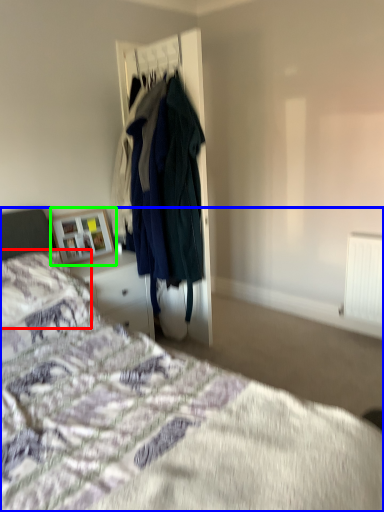
Question: Which object is positioned farthest from pillow (highlighted by a red box)? Select from bed (highlighted by a blue box) and picture frame (highlighted by a green box).

Choices:
 (A) bed
 (B) picture frame

Answer: (B)